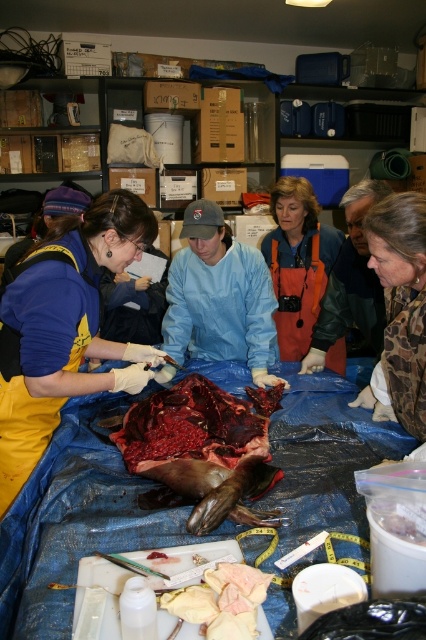
Is the position of blue/yellow jacket at left less distant than that of orange waterproof apron at center?

Yes, it is in front of orange waterproof apron at center.

Can you confirm if blue/yellow jacket at left is taller than orange waterproof apron at center?

Correct, blue/yellow jacket at left is much taller as orange waterproof apron at center.

Which is in front, point (40, 353) or point (282, 298)?

Point (40, 353)

Find the location of a particular element. This screenshot has height=640, width=426. blue/yellow jacket at left is located at coordinates (63, 328).

Between point (117, 225) and point (141, 444), which one is positioned in front?

Point (117, 225) is more forward.

Is point (115, 371) behind point (199, 435)?

No, it is in front of (199, 435).

At what (x,y) coordinates should I click in order to perform the action: click on blue/yellow jacket at left. Please return your answer as a coordinate pair (x, y). The width and height of the screenshot is (426, 640). Looking at the image, I should click on (63, 328).

Between blue/yellow jacket at left and camouflage fabric jacket at lower right, which one has less height?

camouflage fabric jacket at lower right

Which is in front, point (34, 374) or point (423, 381)?

Positioned in front is point (34, 374).

The width and height of the screenshot is (426, 640). Find the location of `blue/yellow jacket at left`. blue/yellow jacket at left is located at coordinates (63, 328).